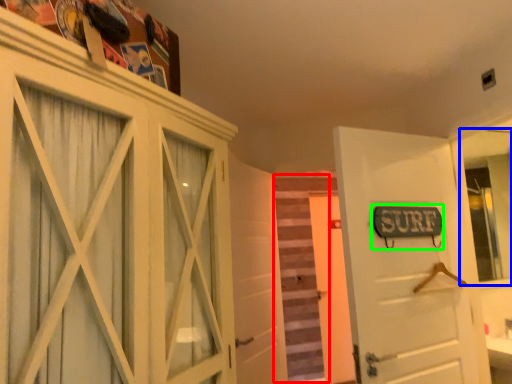
Question: Based on their relative distances, which object is nearer to stair (highlighted by a red box)? Choose from mirror (highlighted by a blue box) and street sign (highlighted by a green box).

Choices:
 (A) mirror
 (B) street sign

Answer: (A)